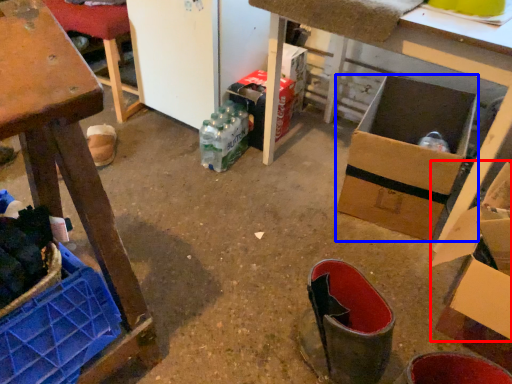
Question: Which point is closer to the camera, cardboard box (highlighted by a red box) or box (highlighted by a blue box)?

Choices:
 (A) cardboard box
 (B) box

Answer: (A)